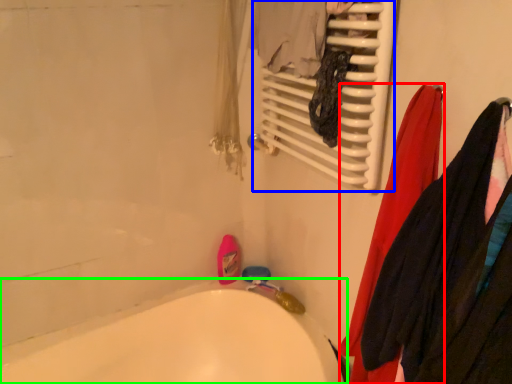
Question: Considering the real-world distances, which object is closest to clothing (highlighted by a red box)? radiator (highlighted by a blue box) or bathtub (highlighted by a green box).

Choices:
 (A) radiator
 (B) bathtub

Answer: (A)